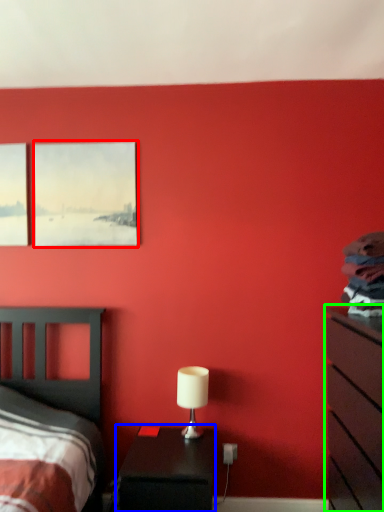
Question: Estimate the real-world distances between objects in this image. Which object is farther from picture frame (highlighted by a red box), nightstand (highlighted by a blue box) or chest of drawers (highlighted by a green box)?

Choices:
 (A) nightstand
 (B) chest of drawers

Answer: (B)